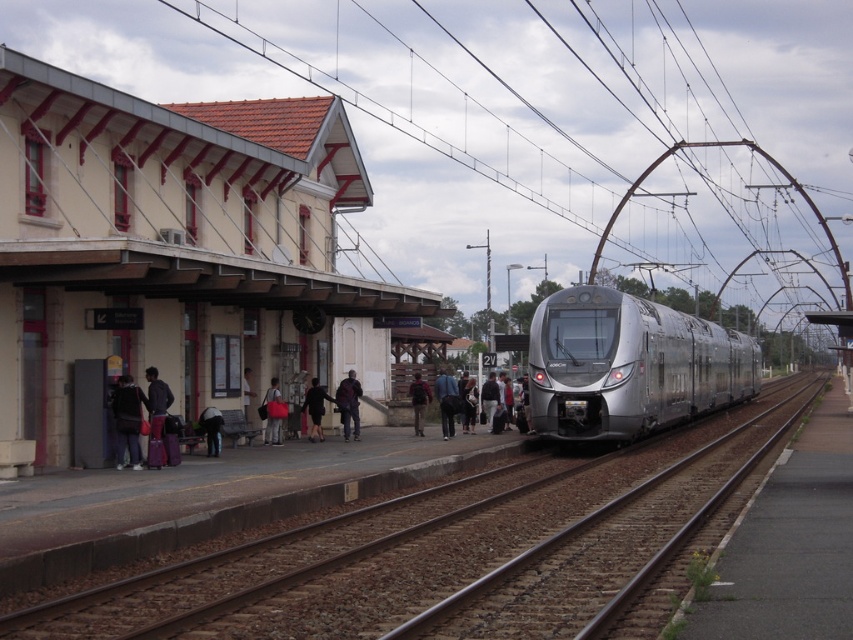
Question: Does dark gray fabric jacket at left appear under dark gray fabric coat at center?

Choices:
 (A) no
 (B) yes

Answer: (A)

Question: Considering the relative positions of white painted wall at center and dark gray fabric backpack at left in the image provided, where is white painted wall at center located with respect to dark gray fabric backpack at left?

Choices:
 (A) left
 (B) right

Answer: (A)

Question: Among these objects, which one is farthest from the camera?

Choices:
 (A) metal tracks at center
 (B) white painted wall at center
 (C) matte red bag at center

Answer: (C)

Question: Can you confirm if silver metallic train at center is positioned to the right of dark gray fabric backpack at left?

Choices:
 (A) yes
 (B) no

Answer: (A)

Question: Which point is farther to the camera?

Choices:
 (A) dark blue jacket at center
 (B) matte red bag at center

Answer: (A)

Question: Which object is farther from the camera taking this photo?

Choices:
 (A) dark gray fabric coat at center
 (B) metal tracks at center
 (C) dark gray fabric jacket at left
 (D) silver metallic train at center

Answer: (A)